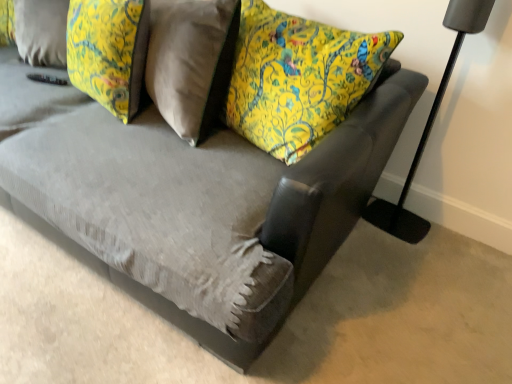
Question: Is yellow floral fabric pillow at upper left inside matte black floor lamp at right?

Choices:
 (A) no
 (B) yes

Answer: (A)

Question: Is matte black floor lamp at right to the right of yellow floral fabric pillow at upper left from the viewer's perspective?

Choices:
 (A) yes
 (B) no

Answer: (A)

Question: Is matte black floor lamp at right facing away from yellow floral fabric pillow at upper left?

Choices:
 (A) yes
 (B) no

Answer: (B)

Question: Can we say matte black floor lamp at right lies outside yellow floral fabric pillow at upper left?

Choices:
 (A) yes
 (B) no

Answer: (A)

Question: Does matte black floor lamp at right have a smaller size compared to yellow floral fabric pillow at upper left?

Choices:
 (A) no
 (B) yes

Answer: (B)

Question: From the image's perspective, is matte black floor lamp at right below yellow floral fabric pillow at upper left?

Choices:
 (A) yes
 (B) no

Answer: (A)

Question: Is matte black floor lamp at right at the back of yellow floral fabric pillow at upper left?

Choices:
 (A) yes
 (B) no

Answer: (B)

Question: Does yellow floral fabric pillow at upper left have a greater width compared to matte black floor lamp at right?

Choices:
 (A) yes
 (B) no

Answer: (A)

Question: Does yellow floral fabric pillow at upper left lie in front of matte black floor lamp at right?

Choices:
 (A) yes
 (B) no

Answer: (B)

Question: Is yellow floral fabric pillow at upper left facing towards matte black floor lamp at right?

Choices:
 (A) yes
 (B) no

Answer: (B)

Question: Can you confirm if yellow floral fabric pillow at upper left is shorter than matte black floor lamp at right?

Choices:
 (A) no
 (B) yes

Answer: (B)

Question: Is yellow floral fabric pillow at upper left to the left of matte black floor lamp at right from the viewer's perspective?

Choices:
 (A) yes
 (B) no

Answer: (A)

Question: Relative to yellow floral fabric pillow at upper left, is matte black floor lamp at right in front or behind?

Choices:
 (A) behind
 (B) front

Answer: (B)